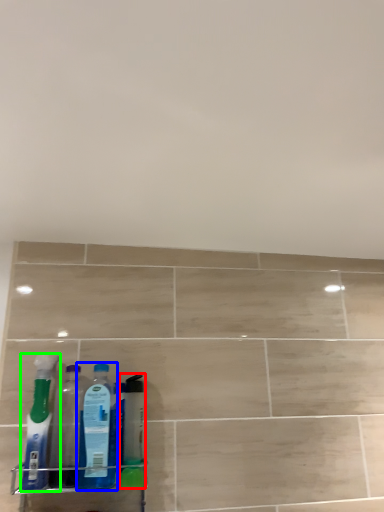
Question: Which object is positioned farthest from cleaning product (highlighted by a red box)? Select from bottle (highlighted by a blue box) and bottle (highlighted by a green box).

Choices:
 (A) bottle
 (B) bottle

Answer: (B)